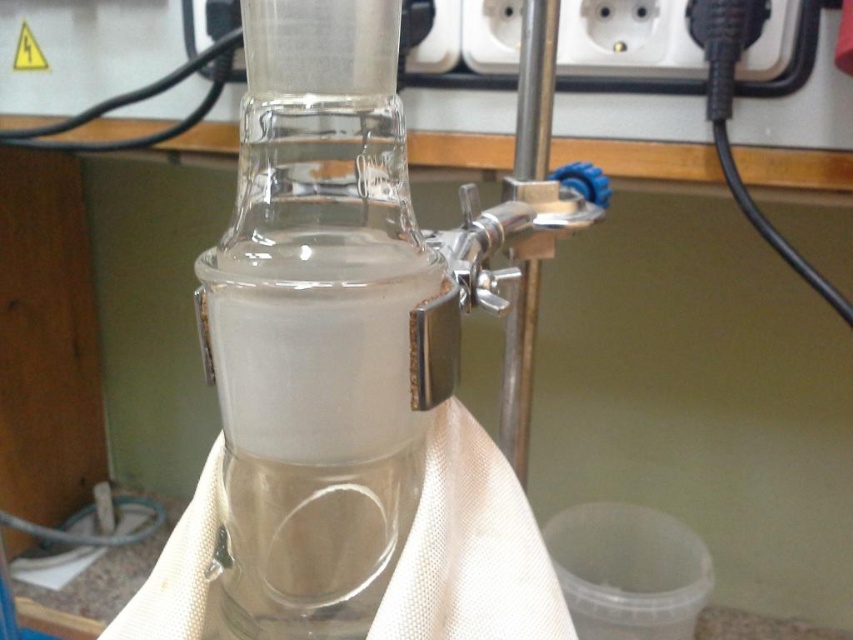
Question: Is transparent glass blender at center below white plastic socket at upper center?

Choices:
 (A) no
 (B) yes

Answer: (B)

Question: Can you confirm if white plastic socket at upper right is positioned below white plastic socket at upper center?

Choices:
 (A) yes
 (B) no

Answer: (A)

Question: Estimate the real-world distances between objects in this image. Which object is farther from the white plastic socket at upper center?

Choices:
 (A) white plastic socket at upper right
 (B) transparent glass blender at center

Answer: (B)

Question: Does transparent glass blender at center appear on the left side of white plastic socket at upper right?

Choices:
 (A) yes
 (B) no

Answer: (A)

Question: Considering the real-world distances, which object is farthest from the white plastic socket at upper center?

Choices:
 (A) white plastic socket at upper right
 (B) transparent glass blender at center

Answer: (B)

Question: Which object is farther from the camera taking this photo?

Choices:
 (A) white plastic socket at upper center
 (B) transparent glass blender at center

Answer: (A)